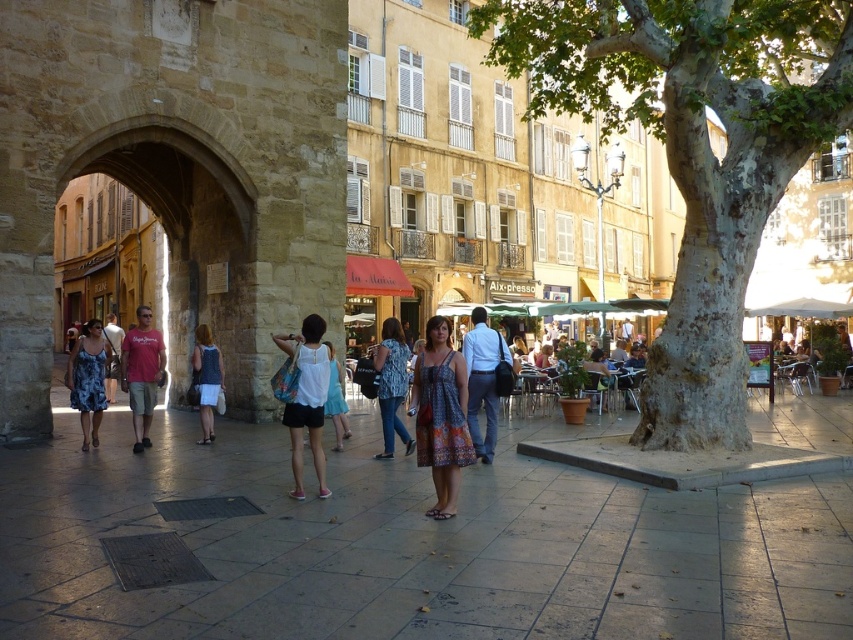
You are a photographer standing at the archway on the left. You want to take a photo of both the dress at center and the denim jeans at center in the same frame. Can you capture both items in your photo without moving your position?

The dress at center is 5.36 meters away from the denim jeans at center. Since they are both positioned at the center of the scene, they are likely within the same field of view, so you can capture both in your photo without moving your position.

You are standing at the archway on the left side of the street. You see two points marked on the ground ahead of you. One is at point (x=625, y=68) and the other is at point (x=393, y=340). Which point is closer to you as you face the street?

Point (x=393, y=340) is closer to you because it is in front of point (x=625, y=68).